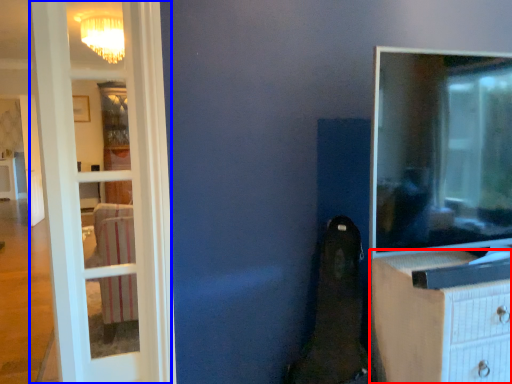
Question: Which of the following is the closest to the observer, chest of drawers (highlighted by a red box) or door (highlighted by a blue box)?

Choices:
 (A) chest of drawers
 (B) door

Answer: (A)